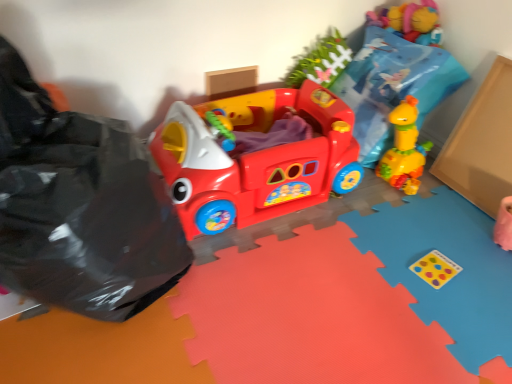
Question: Can you confirm if matte plastic play car at center is smaller than black plastic bag at left?

Choices:
 (A) yes
 (B) no

Answer: (A)

Question: From a real-world perspective, does matte plastic play car at center stand above black plastic bag at left?

Choices:
 (A) yes
 (B) no

Answer: (B)

Question: Is matte plastic play car at center closer to camera compared to black plastic bag at left?

Choices:
 (A) yes
 (B) no

Answer: (B)

Question: Is matte plastic play car at center behind black plastic bag at left?

Choices:
 (A) no
 (B) yes

Answer: (B)

Question: Does matte plastic play car at center have a lesser height compared to black plastic bag at left?

Choices:
 (A) yes
 (B) no

Answer: (A)

Question: Is black plastic bag at left completely or partially inside matte plastic play car at center?

Choices:
 (A) yes
 (B) no

Answer: (B)

Question: From the image's perspective, is black plastic bag at left beneath matte plastic play car at center?

Choices:
 (A) no
 (B) yes

Answer: (B)

Question: Is black plastic bag at left in front of matte plastic play car at center?

Choices:
 (A) no
 (B) yes

Answer: (B)

Question: Is black plastic bag at left far away from matte plastic play car at center?

Choices:
 (A) yes
 (B) no

Answer: (B)

Question: Does black plastic bag at left appear on the right side of matte plastic play car at center?

Choices:
 (A) yes
 (B) no

Answer: (B)

Question: Can you confirm if black plastic bag at left is taller than matte plastic play car at center?

Choices:
 (A) yes
 (B) no

Answer: (A)

Question: From a real-world perspective, does black plastic bag at left stand above matte plastic play car at center?

Choices:
 (A) no
 (B) yes

Answer: (B)

Question: Does point (212, 145) appear closer or farther from the camera than point (68, 208)?

Choices:
 (A) closer
 (B) farther

Answer: (B)